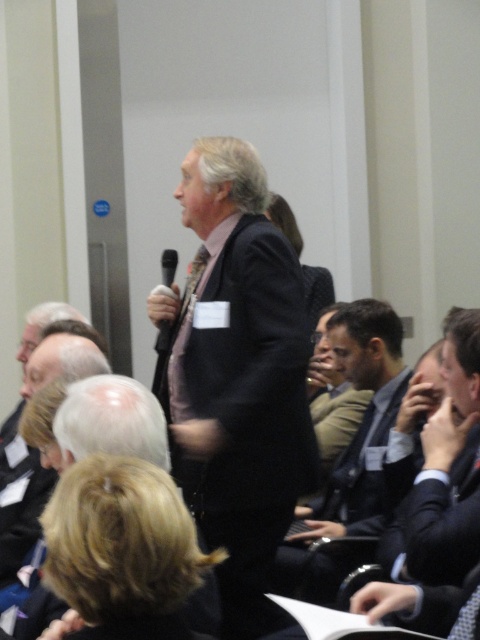
Question: Which object appears farthest from the camera in this image?

Choices:
 (A) dark suit at center
 (B) gray hair at lower left

Answer: (B)

Question: Does dark suit at center come behind dark brown suit at center?

Choices:
 (A) no
 (B) yes

Answer: (A)

Question: Considering the relative positions of dark suit at center and gray hair at lower left in the image provided, where is dark suit at center located with respect to gray hair at lower left?

Choices:
 (A) left
 (B) right

Answer: (B)

Question: Is dark suit at center to the left of dark brown suit at center from the viewer's perspective?

Choices:
 (A) yes
 (B) no

Answer: (A)

Question: Which object is closer to the camera taking this photo?

Choices:
 (A) dark suit at center
 (B) dark brown suit at center

Answer: (A)

Question: Which of the following is the farthest from the observer?

Choices:
 (A) dark brown suit at center
 (B) dark suit at center

Answer: (A)